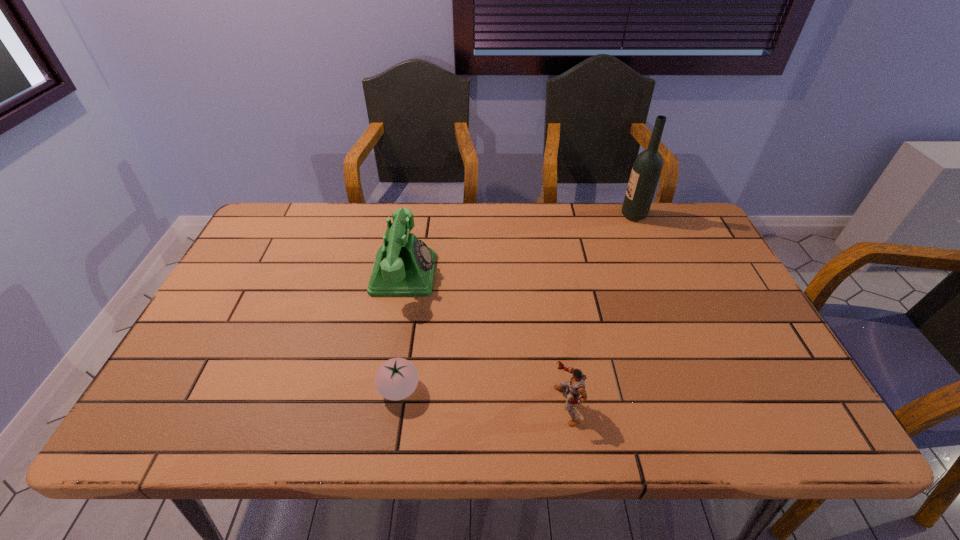
Find the location of `vacant space located on the dial of the third nearest object`. vacant space located on the dial of the third nearest object is located at coordinates (540, 274).

At what (x,y) coordinates should I click in order to perform the action: click on vacant space located on the front-facing side of the second object from right to left. Please return your answer as a coordinate pair (x, y). Looking at the image, I should click on (516, 405).

The width and height of the screenshot is (960, 540). I want to click on free space located on the front-facing side of the second object from right to left, so click(x=521, y=405).

Locate an element on the screen. The image size is (960, 540). free space located 0.380m on the front-facing side of the second object from right to left is located at coordinates (378, 405).

Where is `vacant space located 0.350m on the back of the shortest object`? The height and width of the screenshot is (540, 960). vacant space located 0.350m on the back of the shortest object is located at coordinates (418, 268).

In order to click on wine bottle at the far edge in this screenshot , I will do `click(646, 171)`.

The height and width of the screenshot is (540, 960). Find the location of `telephone located at the far edge`. telephone located at the far edge is located at coordinates (404, 266).

At what (x,y) coordinates should I click in order to perform the action: click on puncher that is at the near edge. Please return your answer as a coordinate pair (x, y). This screenshot has width=960, height=540. Looking at the image, I should click on (576, 386).

Image resolution: width=960 pixels, height=540 pixels. Find the location of `tomato that is at the near edge`. tomato that is at the near edge is located at coordinates (397, 378).

The image size is (960, 540). Find the location of `object that is at the right edge`. object that is at the right edge is located at coordinates (646, 171).